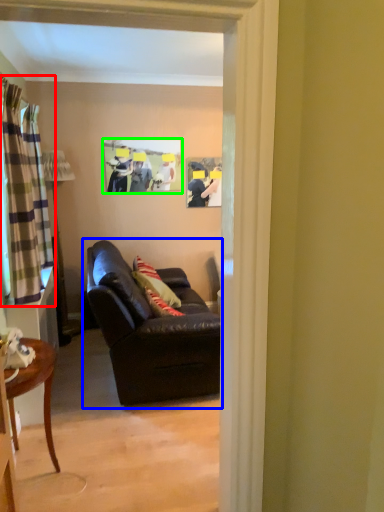
Question: Estimate the real-world distances between objects in this image. Which object is farther from curtain (highlighted by a red box), studio couch (highlighted by a blue box) or picture frame (highlighted by a green box)?

Choices:
 (A) studio couch
 (B) picture frame

Answer: (B)